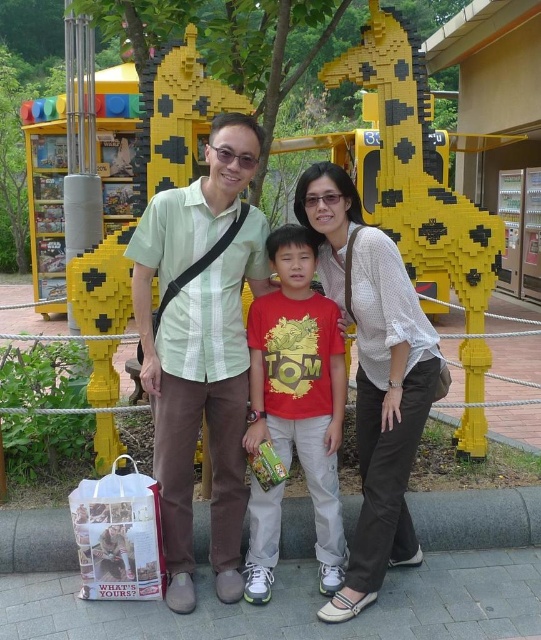
You are a photographer trying to capture a photo of the two people wearing the green striped shirt at center and the red matte shirt at center. Which one should you focus on first if you want to take a photo from the left side of the scene?

The green striped shirt at center should be focused on first because it is positioned to the left of the red matte shirt at center, making it closer to the photographer when approaching from the left side of the scene.

You are a photographer trying to focus on the matte green shirt at center. Based on the coordinates provided in the Objects Description, can you determine if the shirt is positioned in the central area of the image?

The matte green shirt at center is located at coordinates point (372, 372). Since the coordinates are close to the center of the image, the shirt is positioned in the central area of the image.